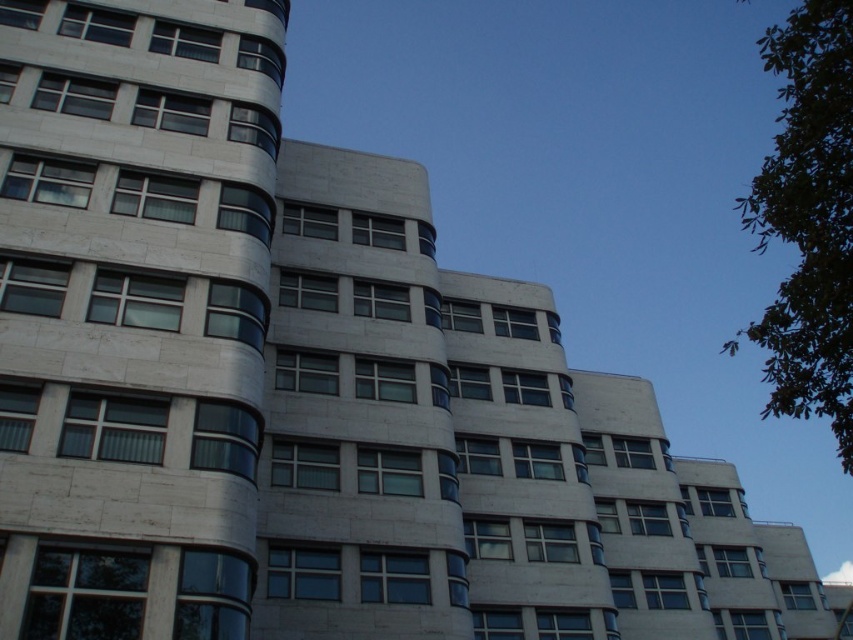
Question: Does white marble building at center come in front of green leafy tree at upper right?

Choices:
 (A) no
 (B) yes

Answer: (A)

Question: Can you confirm if white marble building at center is positioned to the left of green leafy tree at upper right?

Choices:
 (A) no
 (B) yes

Answer: (B)

Question: Is the position of white marble building at center less distant than that of green leafy tree at upper right?

Choices:
 (A) yes
 (B) no

Answer: (B)

Question: Which point is farther to the camera?

Choices:
 (A) (184, 632)
 (B) (762, 209)

Answer: (A)

Question: Among these points, which one is nearest to the camera?

Choices:
 (A) (793, 195)
 (B) (77, 432)

Answer: (A)